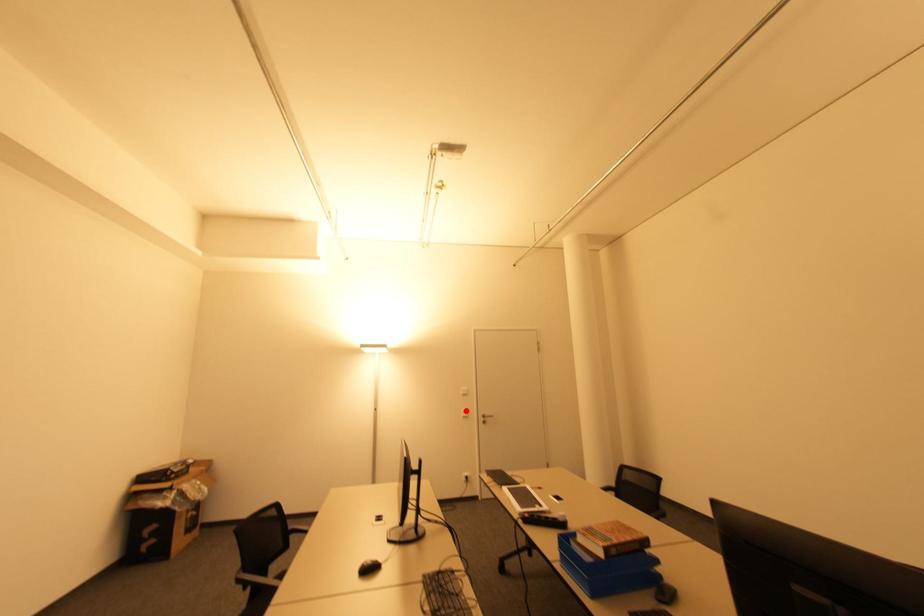
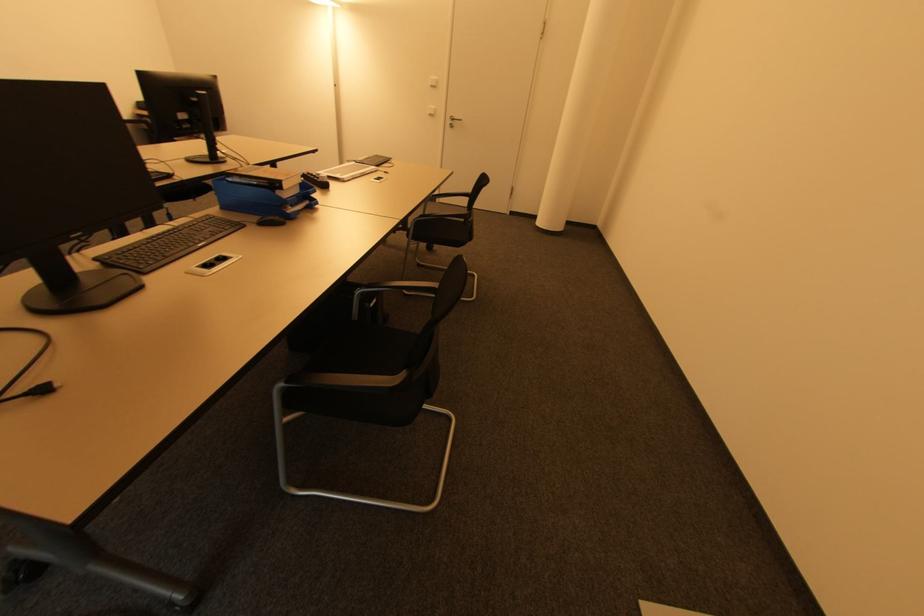
Find the pixel in the second image that matches the highlighted location in the first image.

(433, 108)